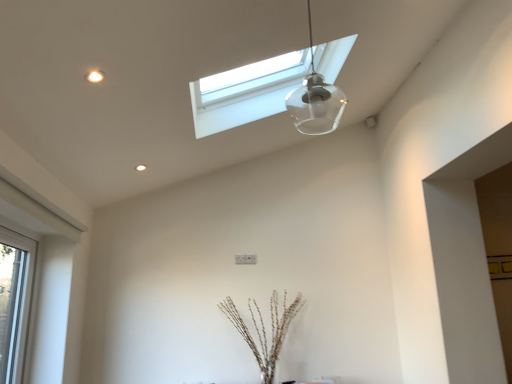
Question: Choose the correct answer: Is brown textured sticks at center inside transparent glass pendant light at upper center or outside it?

Choices:
 (A) inside
 (B) outside

Answer: (B)

Question: From a real-world perspective, is brown textured sticks at center above or below transparent glass pendant light at upper center?

Choices:
 (A) below
 (B) above

Answer: (A)

Question: Estimate the real-world distances between objects in this image. Which object is farther from the transparent glass window at upper center, the second window when ordered from bottom to top?

Choices:
 (A) clear glass window at left, the 2th window in the top-to-bottom sequence
 (B) transparent glass pendant light at upper center
 (C) brown textured sticks at center

Answer: (A)

Question: Which object is positioned farthest from the clear glass window at left, the first window viewed from the left?

Choices:
 (A) transparent glass pendant light at upper center
 (B) brown textured sticks at center
 (C) transparent glass window at upper center, the first window positioned from the right

Answer: (A)